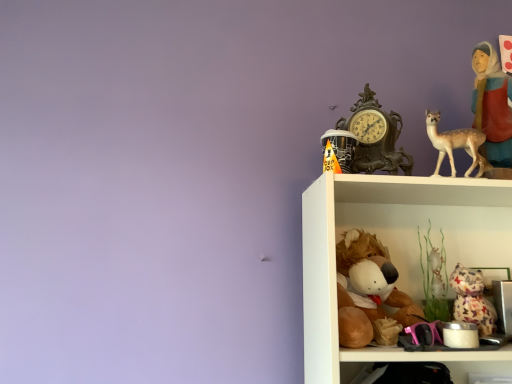
Measure the distance between patterned fabric cat at lower right, the third toy positioned from the left, and camera.

patterned fabric cat at lower right, the third toy positioned from the left, is 36.12 inches away from camera.

Describe the element at coordinates (375, 137) in the screenshot. This screenshot has height=384, width=512. I see `antique bronze clock at upper right` at that location.

The height and width of the screenshot is (384, 512). Describe the element at coordinates (340, 147) in the screenshot. I see `orange paper cone at upper right, the third toy positioned from the right` at that location.

What do you see at coordinates (456, 145) in the screenshot? The width and height of the screenshot is (512, 384). I see `light beige porcelain deer at upper right` at bounding box center [456, 145].

At what (x,y) coordinates should I click in order to perform the action: click on matte red fabric at upper right. Please return your answer as a coordinate pair (x, y). Image resolution: width=512 pixels, height=384 pixels. Looking at the image, I should click on (492, 105).

Can you confirm if patterned fabric cat at lower right, which is the 1th toy from right to left, is thinner than brown plush toy at lower center, the 2th toy positioned from the left?

Correct, the width of patterned fabric cat at lower right, which is the 1th toy from right to left, is less than that of brown plush toy at lower center, the 2th toy positioned from the left.

From the image's perspective, is patterned fabric cat at lower right, the third toy positioned from the left, located beneath brown plush toy at lower center, the 2th toy positioned from the left?

Correct, patterned fabric cat at lower right, the third toy positioned from the left, appears lower than brown plush toy at lower center, the 2th toy positioned from the left, in the image.

Are patterned fabric cat at lower right, which is the 1th toy from right to left, and brown plush toy at lower center, the 2th toy positioned from the left, far apart?

No, patterned fabric cat at lower right, which is the 1th toy from right to left, is not far away from brown plush toy at lower center, the 2th toy positioned from the left.

Which object is more forward, patterned fabric cat at lower right, the third toy positioned from the left, or brown plush toy at lower center, the 2th toy from the right?

Positioned in front is brown plush toy at lower center, the 2th toy from the right.

Does orange paper cone at upper right, the third toy positioned from the right, appear on the right side of antique bronze clock at upper right?

Incorrect, orange paper cone at upper right, the third toy positioned from the right, is not on the right side of antique bronze clock at upper right.

In order to click on the 1st toy directly beneath the antique bronze clock at upper right (from a real-world perspective) in this screenshot , I will do `click(340, 147)`.

Which is behind, orange paper cone at upper right, the third toy positioned from the right, or antique bronze clock at upper right?

antique bronze clock at upper right is more distant.

Is orange paper cone at upper right, the third toy positioned from the right, not near antique bronze clock at upper right?

orange paper cone at upper right, the third toy positioned from the right, is near antique bronze clock at upper right, not far away.

Which of these two, brown plush toy at lower center, the 2th toy from the right, or patterned fabric cat at lower right, which is the 1th toy from right to left, is smaller?

Smaller between the two is patterned fabric cat at lower right, which is the 1th toy from right to left.

From the picture: Considering the sizes of objects brown plush toy at lower center, the 2th toy positioned from the left, and patterned fabric cat at lower right, the third toy positioned from the left, in the image provided, who is taller, brown plush toy at lower center, the 2th toy positioned from the left, or patterned fabric cat at lower right, the third toy positioned from the left,?

Standing taller between the two is brown plush toy at lower center, the 2th toy positioned from the left.

What's the angular difference between brown plush toy at lower center, the 2th toy from the right, and patterned fabric cat at lower right, the third toy positioned from the left,'s facing directions?

3.09 degrees separate the facing orientations of brown plush toy at lower center, the 2th toy from the right, and patterned fabric cat at lower right, the third toy positioned from the left.

Does matte red fabric at upper right have a greater width compared to orange paper cone at upper right, the third toy positioned from the right?

Yes.

Considering the positions of objects matte red fabric at upper right and orange paper cone at upper right, arranged as the 1th toy when viewed from the left, in the image provided, who is more to the left, matte red fabric at upper right or orange paper cone at upper right, arranged as the 1th toy when viewed from the left,?

Positioned to the left is orange paper cone at upper right, arranged as the 1th toy when viewed from the left.

Between matte red fabric at upper right and orange paper cone at upper right, the third toy positioned from the right, which one has more height?

With more height is matte red fabric at upper right.

Is matte red fabric at upper right bigger than orange paper cone at upper right, the third toy positioned from the right?

Yes, matte red fabric at upper right is bigger than orange paper cone at upper right, the third toy positioned from the right.

From a real-world perspective, which toy is the 2nd one underneath the orange paper cone at upper right, the third toy positioned from the right? Please provide its 2D coordinates.

[(472, 300)]

From the image's perspective, is orange paper cone at upper right, the third toy positioned from the right, beneath patterned fabric cat at lower right, which is the 1th toy from right to left?

No, from the image's perspective, orange paper cone at upper right, the third toy positioned from the right, is not below patterned fabric cat at lower right, which is the 1th toy from right to left.

Is orange paper cone at upper right, the third toy positioned from the right, situated inside patterned fabric cat at lower right, the third toy positioned from the left, or outside?

orange paper cone at upper right, the third toy positioned from the right, is outside patterned fabric cat at lower right, the third toy positioned from the left.

Is matte red fabric at upper right thinner than light beige porcelain deer at upper right?

No, matte red fabric at upper right is not thinner than light beige porcelain deer at upper right.

In the image, is matte red fabric at upper right on the left side or the right side of light beige porcelain deer at upper right?

In the image, matte red fabric at upper right appears on the right side of light beige porcelain deer at upper right.

Between matte red fabric at upper right and light beige porcelain deer at upper right, which one has smaller size?

light beige porcelain deer at upper right is smaller.

Considering the sizes of matte red fabric at upper right and light beige porcelain deer at upper right in the image, is matte red fabric at upper right taller or shorter than light beige porcelain deer at upper right?

Clearly, matte red fabric at upper right is taller compared to light beige porcelain deer at upper right.

Is patterned fabric cat at lower right, which is the 1th toy from right to left, closer to camera compared to orange paper cone at upper right, arranged as the 1th toy when viewed from the left?

No, patterned fabric cat at lower right, which is the 1th toy from right to left, is further to the viewer.

Is patterned fabric cat at lower right, the third toy positioned from the left, aimed at orange paper cone at upper right, arranged as the 1th toy when viewed from the left?

No.

Between point (465, 314) and point (346, 170), which one is positioned behind?

The point (465, 314) is behind.

Can you confirm if patterned fabric cat at lower right, the third toy positioned from the left, is shorter than orange paper cone at upper right, the third toy positioned from the right?

Incorrect, the height of patterned fabric cat at lower right, the third toy positioned from the left, does not fall short of that of orange paper cone at upper right, the third toy positioned from the right.

In the image, there is a brown plush toy at lower center, the 2th toy positioned from the left. Find the location of `toy below it (from the image's perspective)`. toy below it (from the image's perspective) is located at coordinates (472, 300).

From a real-world perspective, starting from the antique bronze clock at upper right, which toy is the 1st one below it? Please provide its 2D coordinates.

[(340, 147)]

Which object lies nearer to the anchor point light beige porcelain deer at upper right, matte red fabric at upper right or brown plush toy at lower center, the 2th toy from the right?

Based on the image, matte red fabric at upper right appears to be nearer to light beige porcelain deer at upper right.

Considering their positions, is antique bronze clock at upper right positioned closer to patterned fabric cat at lower right, the third toy positioned from the left, than matte red fabric at upper right?

antique bronze clock at upper right is closer to patterned fabric cat at lower right, the third toy positioned from the left.

From the image, which object appears to be farther from light beige porcelain deer at upper right, orange paper cone at upper right, the third toy positioned from the right, or brown plush toy at lower center, the 2th toy from the right?

Based on the image, brown plush toy at lower center, the 2th toy from the right, appears to be further to light beige porcelain deer at upper right.

When comparing their distances from orange paper cone at upper right, arranged as the 1th toy when viewed from the left, does antique bronze clock at upper right or light beige porcelain deer at upper right seem further?

The object further to orange paper cone at upper right, arranged as the 1th toy when viewed from the left, is light beige porcelain deer at upper right.

Considering their positions, is patterned fabric cat at lower right, which is the 1th toy from right to left, positioned closer to matte red fabric at upper right than brown plush toy at lower center, the 2th toy positioned from the left?

Among the two, patterned fabric cat at lower right, which is the 1th toy from right to left, is located nearer to matte red fabric at upper right.

Considering their positions, is brown plush toy at lower center, the 2th toy from the right, positioned further to matte red fabric at upper right than antique bronze clock at upper right?

brown plush toy at lower center, the 2th toy from the right, is further to matte red fabric at upper right.

Estimate the real-world distances between objects in this image. Which object is closer to orange paper cone at upper right, arranged as the 1th toy when viewed from the left, brown plush toy at lower center, the 2th toy from the right, or matte red fabric at upper right?

Among the two, brown plush toy at lower center, the 2th toy from the right, is located nearer to orange paper cone at upper right, arranged as the 1th toy when viewed from the left.

From the image, which object appears to be nearer to brown plush toy at lower center, the 2th toy from the right, light beige porcelain deer at upper right or matte red fabric at upper right?

light beige porcelain deer at upper right.

The image size is (512, 384). In order to click on toy situated between orange paper cone at upper right, the third toy positioned from the right, and patterned fabric cat at lower right, the third toy positioned from the left, from left to right in this screenshot , I will do `click(369, 293)`.

Where is `clock situated between orange paper cone at upper right, arranged as the 1th toy when viewed from the left, and light beige porcelain deer at upper right from left to right`? The image size is (512, 384). clock situated between orange paper cone at upper right, arranged as the 1th toy when viewed from the left, and light beige porcelain deer at upper right from left to right is located at coordinates (375, 137).

Identify the location of deer between matte red fabric at upper right and patterned fabric cat at lower right, the third toy positioned from the left, in the up-down direction. The width and height of the screenshot is (512, 384). (456, 145).

The image size is (512, 384). I want to click on clock between orange paper cone at upper right, arranged as the 1th toy when viewed from the left, and matte red fabric at upper right from left to right, so click(375, 137).